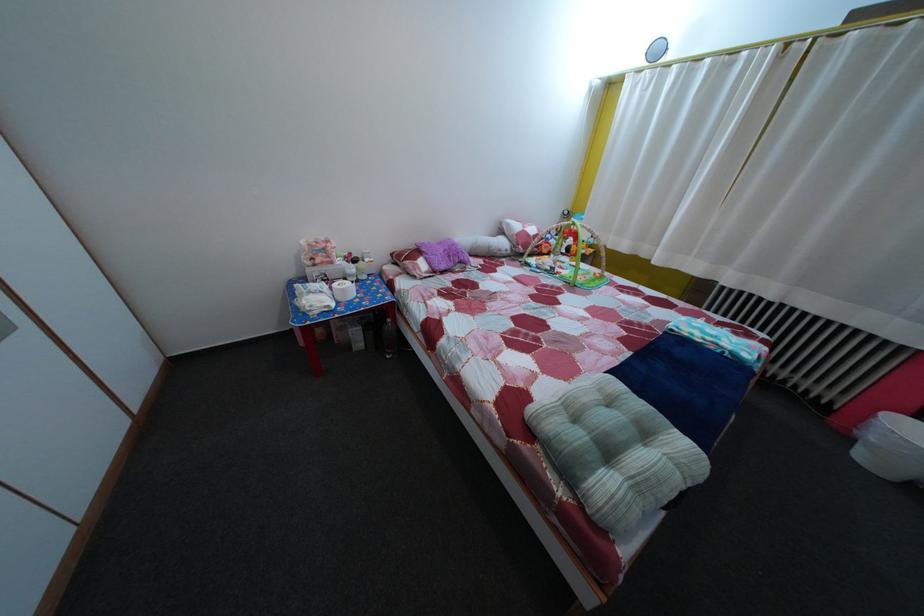
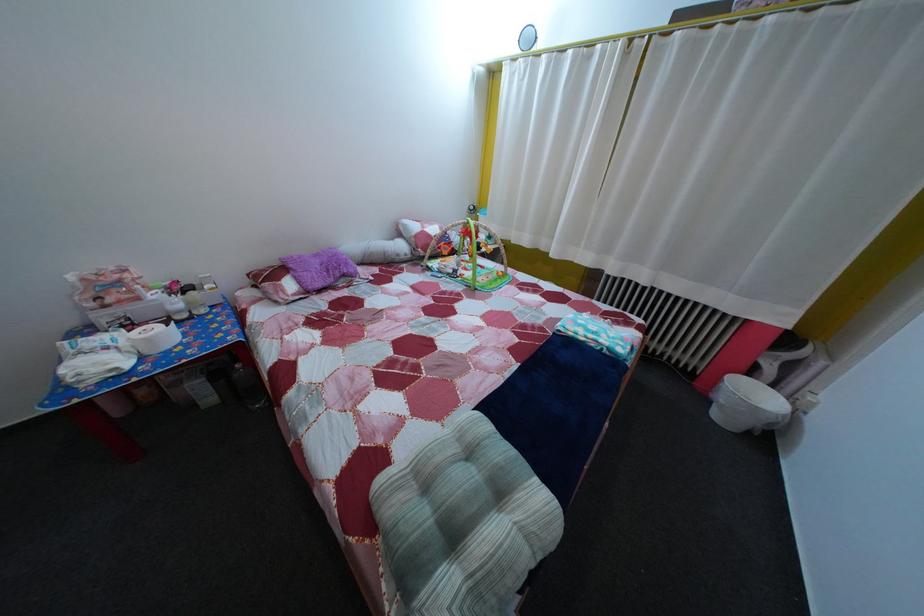
Where in the second image is the point corresponding to point 558,276 from the first image?

(459, 278)